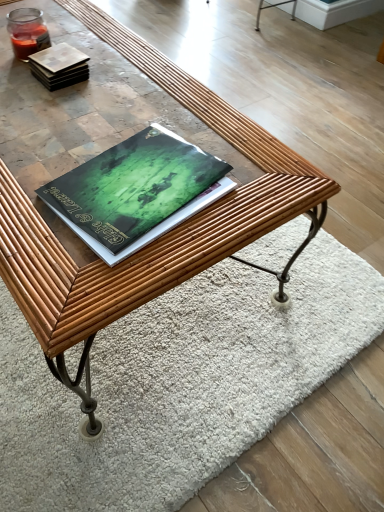
In order to click on vacant space that is to the left of green matte book at center, acting as the second book starting from the back in this screenshot , I will do `click(37, 165)`.